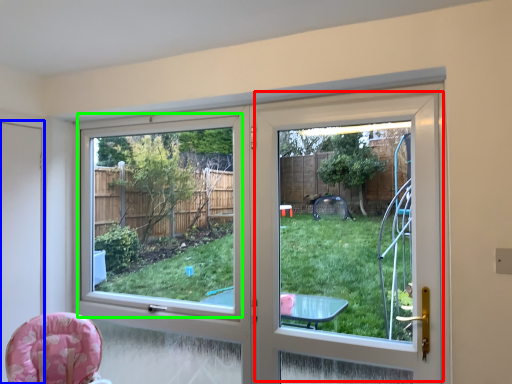
Question: Which object is the closest to the screen door (highlighted by a red box)? Choose among these: screen door (highlighted by a blue box) or window screen (highlighted by a green box).

Choices:
 (A) screen door
 (B) window screen

Answer: (A)